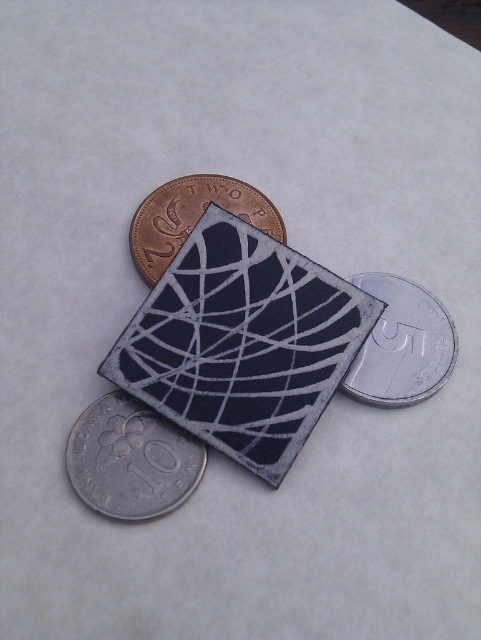
Is silver metallic coin at lower left to the right of silver metallic coin at right from the viewer's perspective?

Incorrect, silver metallic coin at lower left is not on the right side of silver metallic coin at right.

Where is `silver metallic coin at lower left`? The height and width of the screenshot is (640, 481). silver metallic coin at lower left is located at coordinates (130, 460).

In order to click on silver metallic coin at lower left in this screenshot , I will do `click(130, 460)`.

Does silver metallic coin at lower left have a lesser width compared to brass metallic coin at upper left?

Yes, silver metallic coin at lower left is thinner than brass metallic coin at upper left.

Where is `silver metallic coin at lower left`? Image resolution: width=481 pixels, height=640 pixels. silver metallic coin at lower left is located at coordinates (130, 460).

Who is more distant from viewer, (125, 424) or (131, 241)?

Positioned behind is point (131, 241).

This screenshot has height=640, width=481. Find the location of `silver metallic coin at lower left`. silver metallic coin at lower left is located at coordinates (130, 460).

Is point (445, 376) positioned behind point (227, 179)?

No, (445, 376) is in front of (227, 179).

Does silver metallic coin at right appear on the right side of brass metallic coin at upper left?

Yes, silver metallic coin at right is to the right of brass metallic coin at upper left.

Is point (415, 369) positioned in front of point (151, 282)?

Yes, point (415, 369) is in front of point (151, 282).

The image size is (481, 640). Identify the location of silver metallic coin at right. (402, 344).